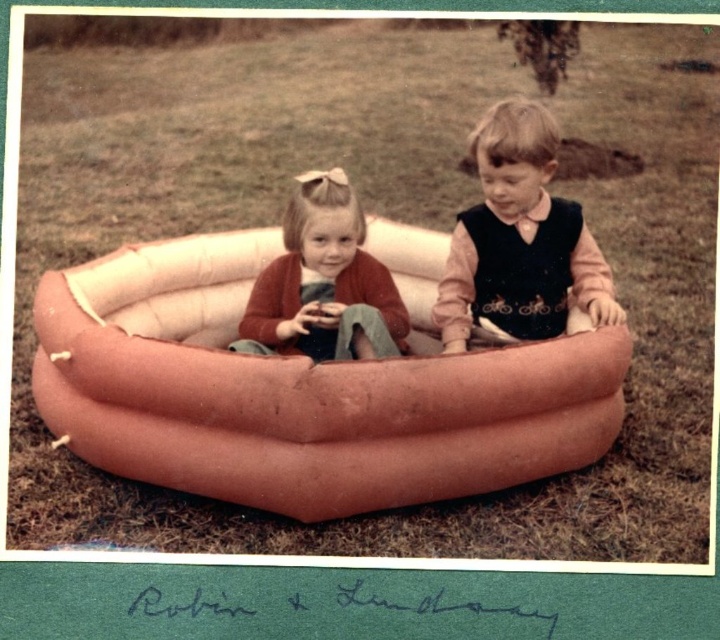
You are standing at the point labeled point (541, 164) and want to throw a ball to a friend who is standing 4 meters away from you. Can you reach your friend with the throw?

The distance between you and your friend is 3.87 meters, so yes, you can reach your friend with the throw since it is within the 4 meters range.